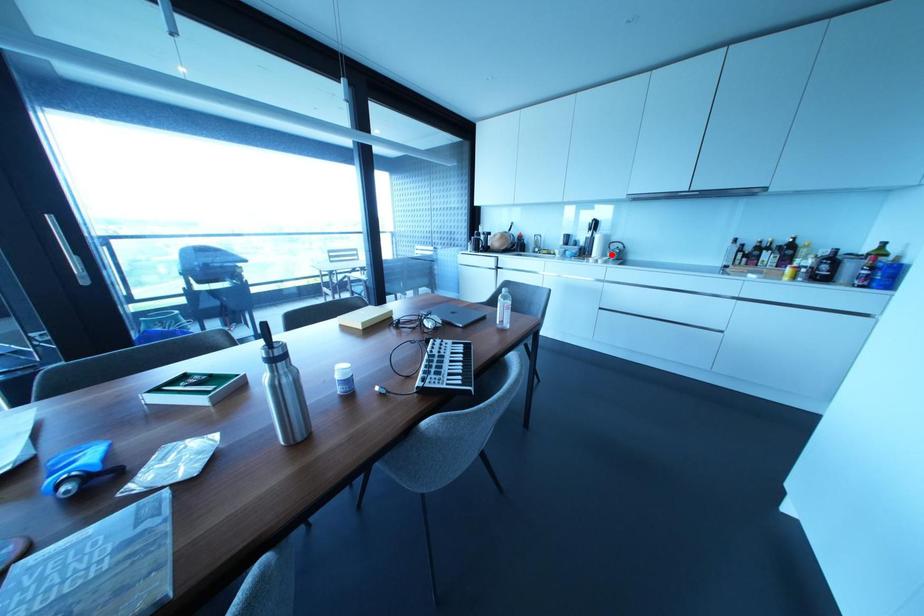
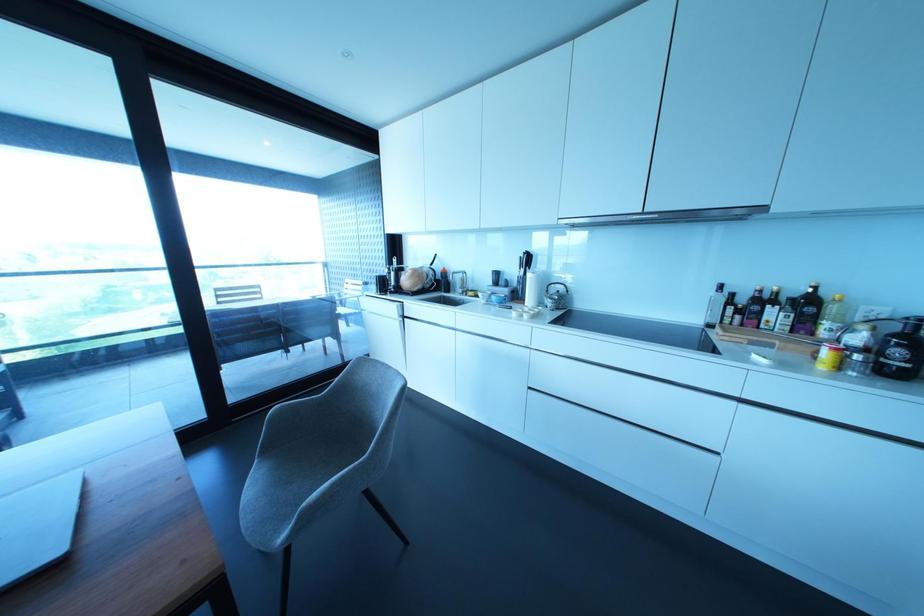
In the second image, find the point that corresponds to the highlighted location in the first image.

(549, 302)